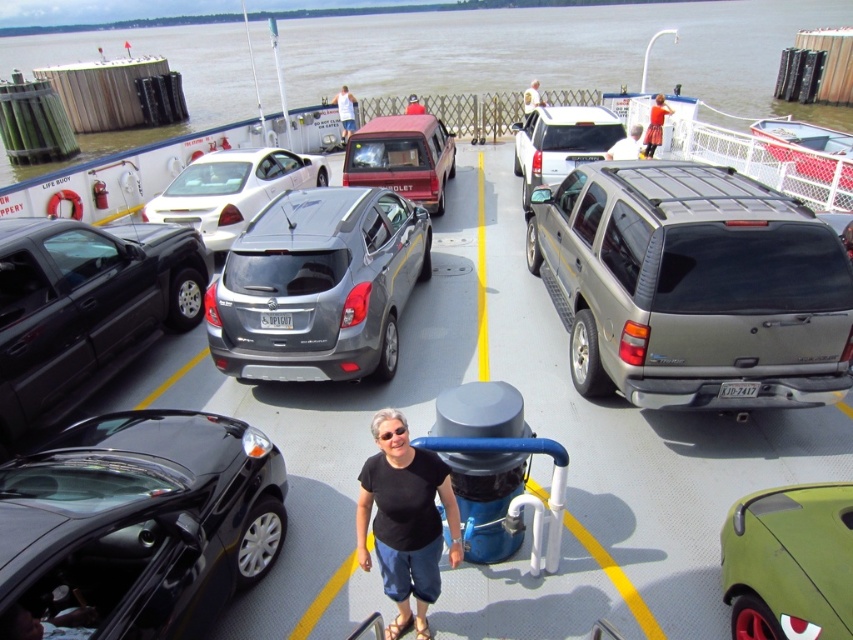
You are a passenger on the ferry and want to take a photo of the satin black minivan at left and light blue jeans at center. Which vehicle should you focus on first if you want to capture both in a single frame without zooming in or out?

The satin black minivan at left is smaller in size compared to the light blue jeans at center, so you should focus on the light blue jeans at center first to ensure it fits properly in the frame before adjusting for the smaller minivan.

You are a photographer standing on the ferry deck. You want to take a photo of the black cotton shirt at center and the matte red minivan at center. Which object should you zoom in on to capture both in the frame without moving the camera?

The black cotton shirt at center has a lesser width compared to matte red minivan at center, so you should zoom in on the matte red minivan at center to ensure both fit in the frame.